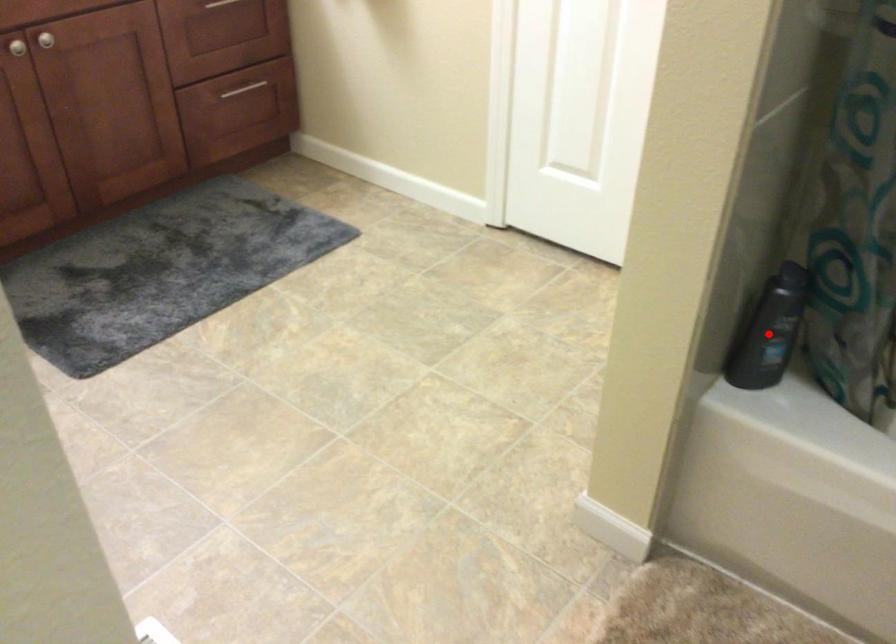
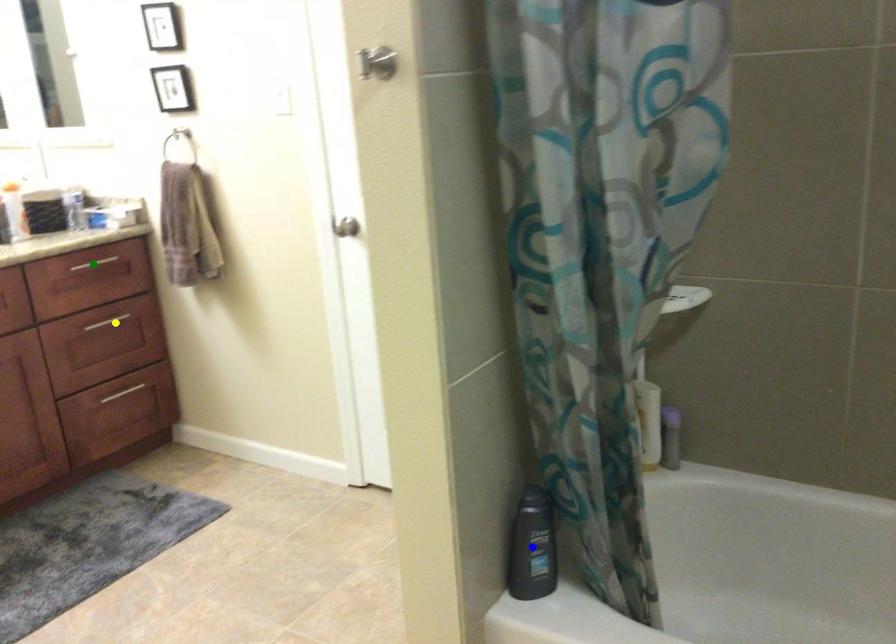
Question: I am providing you with two images of the same scene from different viewpoints. A red point is marked on the first image. You are given multiple points on the second image. Which point in image 2 is actually the same real-world point as the red point in image 1?

Choices:
 (A) yellow point
 (B) blue point
 (C) green point

Answer: (B)